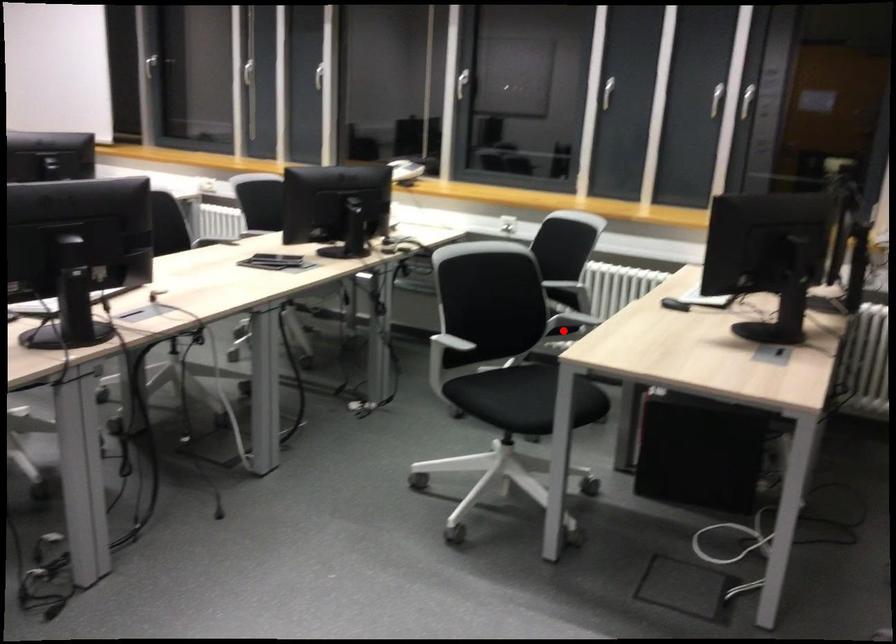
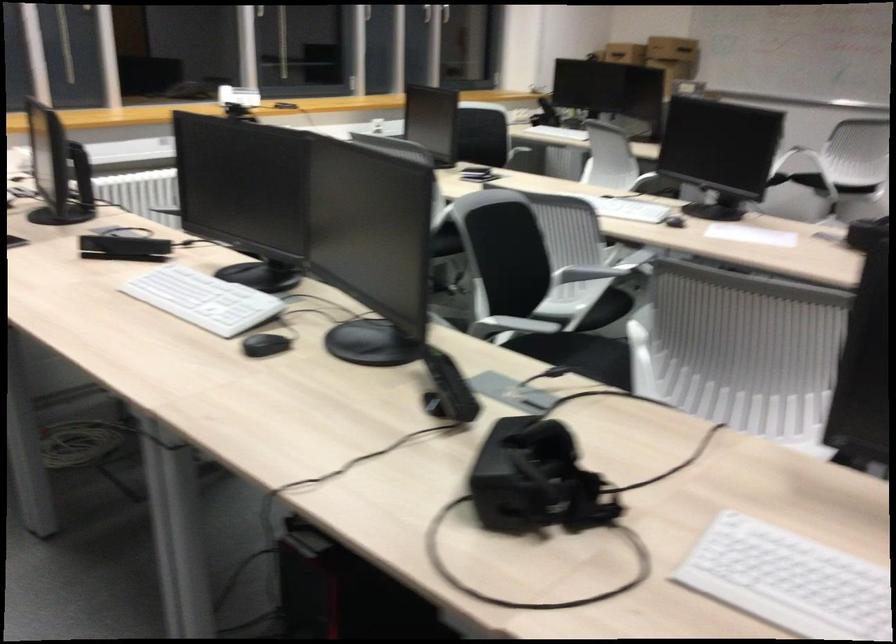
Question: I am providing you with two images of the same scene from different viewpoints. A red point is marked on the first image. Is the red point's position out of view in image 2?

Choices:
 (A) Yes
 (B) No

Answer: (A)